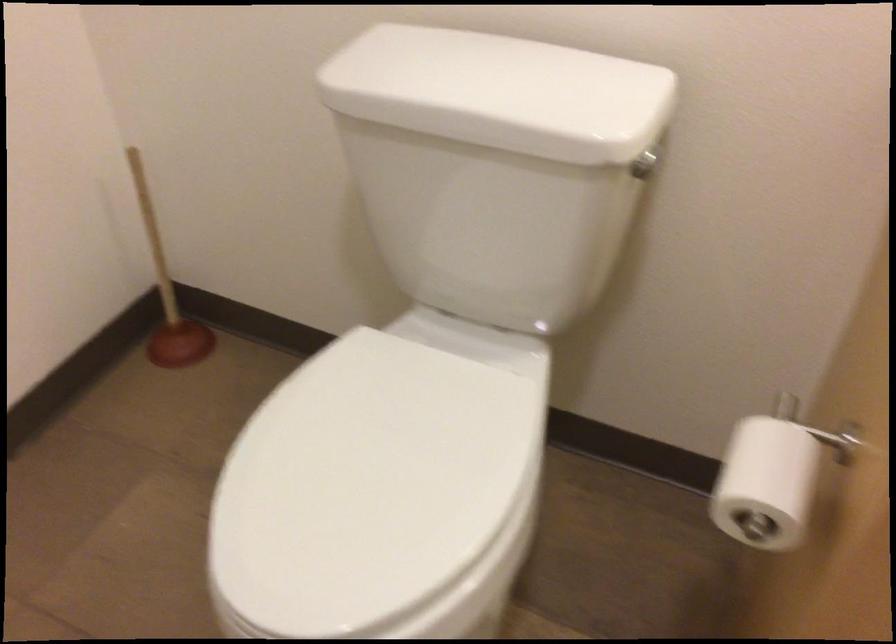
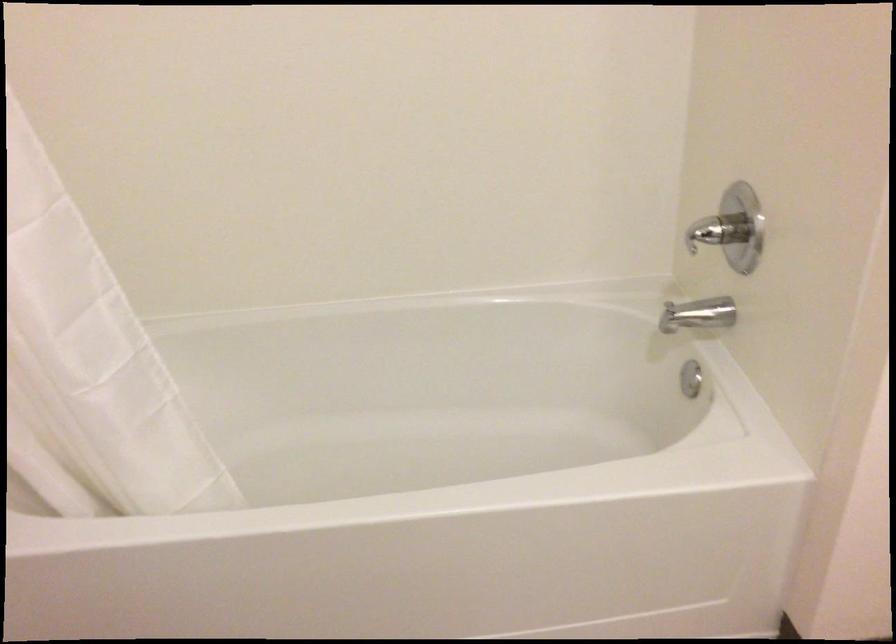
Question: Based on the continuous images, in which direction is the camera rotating? Reply with the corresponding letter.

Choices:
 (A) Left
 (B) Right
 (C) Up
 (D) Down

Answer: (A)